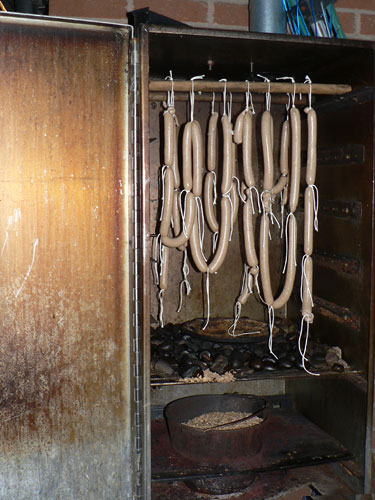
Where is `cooker`? cooker is located at coordinates (352, 198).